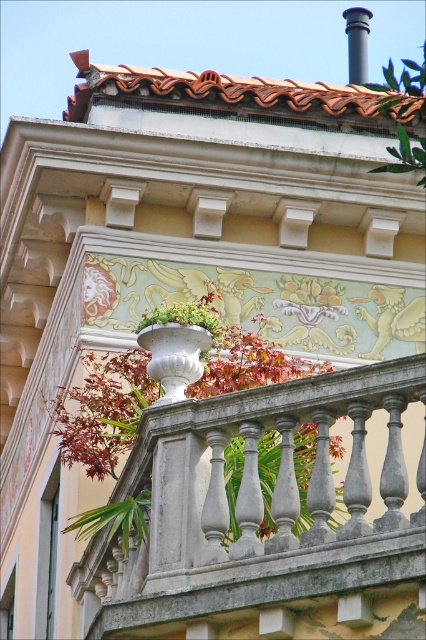
Question: Which object is positioned closest to the white stone planter at upper center?

Choices:
 (A) white glossy planter at center
 (B) green leafy plant at upper right

Answer: (A)

Question: Does green leafy plant at upper right appear on the left side of white glossy planter at center?

Choices:
 (A) yes
 (B) no

Answer: (B)

Question: Among these objects, which one is nearest to the camera?

Choices:
 (A) green leafy plant at upper right
 (B) white stone planter at upper center

Answer: (A)

Question: Does white stone planter at upper center have a lesser width compared to green leafy plant at upper right?

Choices:
 (A) no
 (B) yes

Answer: (A)

Question: Where is white stone planter at upper center located in relation to white glossy planter at center in the image?

Choices:
 (A) above
 (B) below

Answer: (B)

Question: Which point is farther to the camera?

Choices:
 (A) white stone planter at upper center
 (B) green leafy plant at upper right
 (C) white glossy planter at center

Answer: (C)